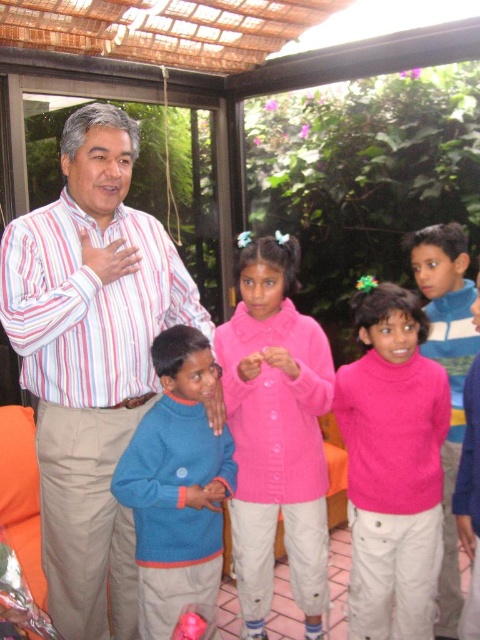
Between pink matte sweater at center and pink woolen sweater at center, which one is positioned lower?

pink woolen sweater at center is below.

Can you confirm if pink matte sweater at center is thinner than pink woolen sweater at center?

In fact, pink matte sweater at center might be wider than pink woolen sweater at center.

The height and width of the screenshot is (640, 480). Describe the element at coordinates (276, 433) in the screenshot. I see `pink matte sweater at center` at that location.

This screenshot has height=640, width=480. Find the location of `pink matte sweater at center`. pink matte sweater at center is located at coordinates (276, 433).

Is pink matte sweater at center positioned at the back of blue sweater at center?

That is True.

What do you see at coordinates (276, 433) in the screenshot? I see `pink matte sweater at center` at bounding box center [276, 433].

Is point (269, 428) closer to camera compared to point (187, 380)?

That is False.

Locate an element on the screen. This screenshot has height=640, width=480. pink matte sweater at center is located at coordinates (276, 433).

Does pink woolen sweater at center have a lesser width compared to blue sweater at center?

Incorrect, pink woolen sweater at center's width is not less than blue sweater at center's.

Between pink woolen sweater at center and blue sweater at center, which one has less height?

Standing shorter between the two is blue sweater at center.

This screenshot has width=480, height=640. I want to click on pink woolen sweater at center, so click(393, 465).

Identify the location of pink woolen sweater at center. (393, 465).